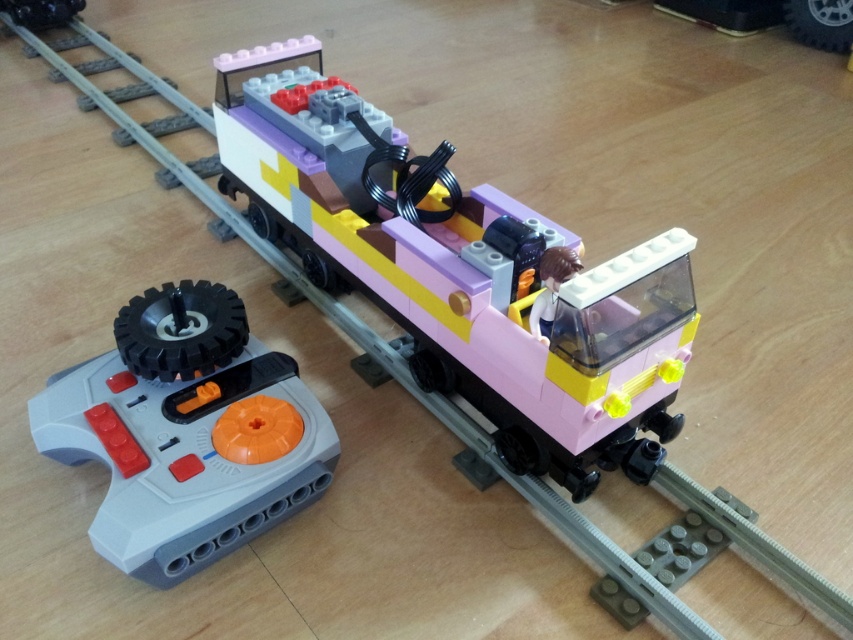
Between gray plastic remote control at lower left and metallic black remote control at upper left, which one is positioned higher?

Positioned higher is metallic black remote control at upper left.

Does point (196, 480) come closer to viewer compared to point (30, 10)?

Yes, it is.

Where is `gray plastic remote control at lower left`? The height and width of the screenshot is (640, 853). gray plastic remote control at lower left is located at coordinates (187, 433).

Locate an element on the screen. Image resolution: width=853 pixels, height=640 pixels. gray plastic remote control at lower left is located at coordinates (187, 433).

Is pastel pink plastic train car at center to the right of metallic black remote control at upper left from the viewer's perspective?

Indeed, pastel pink plastic train car at center is positioned on the right side of metallic black remote control at upper left.

Which is in front, point (329, 163) or point (57, 8)?

Point (329, 163) is more forward.

This screenshot has width=853, height=640. Identify the location of pastel pink plastic train car at center. (461, 269).

Is pastel pink plastic train car at center to the right of gray plastic remote control at lower left from the viewer's perspective?

Indeed, pastel pink plastic train car at center is positioned on the right side of gray plastic remote control at lower left.

Who is lower down, pastel pink plastic train car at center or gray plastic remote control at lower left?

gray plastic remote control at lower left is below.

You are a GUI agent. You are given a task and a screenshot of the screen. Output one action in this format:
    pyautogui.click(x=<x>, y=<y>)
    Task: Click on the pastel pink plastic train car at center
    The image size is (853, 640).
    Given the screenshot: What is the action you would take?
    pyautogui.click(x=461, y=269)

The height and width of the screenshot is (640, 853). Find the location of `pastel pink plastic train car at center`. pastel pink plastic train car at center is located at coordinates (461, 269).